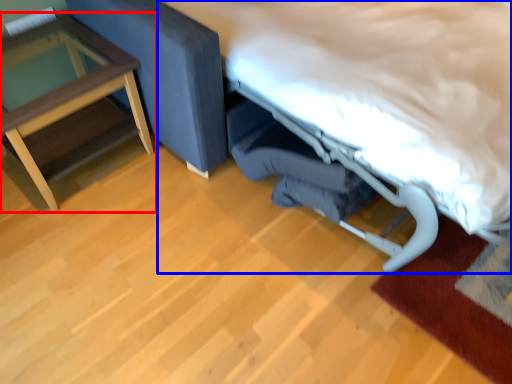
Question: Which point is further to the camera, table (highlighted by a red box) or bed (highlighted by a blue box)?

Choices:
 (A) table
 (B) bed

Answer: (A)